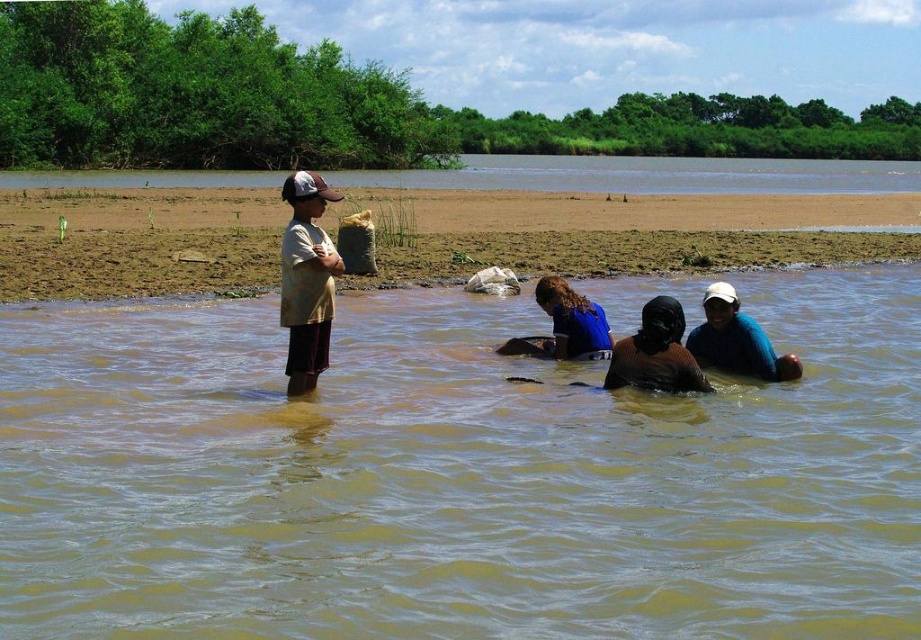
Between brown muddy water at center and brown matte headscarf at center, which one is positioned higher?

brown matte headscarf at center is above.

What are the coordinates of `brown muddy water at center` in the screenshot? It's located at 455,477.

Who is positioned more to the right, brown sandy riverbank at upper center or brown matte headscarf at center?

From the viewer's perspective, brown sandy riverbank at upper center appears more on the right side.

Who is more forward, (165, 172) or (659, 307)?

Point (659, 307)

Image resolution: width=921 pixels, height=640 pixels. Find the location of `brown sandy riverbank at upper center`. brown sandy riverbank at upper center is located at coordinates (648, 176).

Is brown muddy ground at center below blue fabric headscarf at lower center?

No, brown muddy ground at center is not below blue fabric headscarf at lower center.

Can you confirm if brown muddy ground at center is positioned to the left of blue fabric headscarf at lower center?

Indeed, brown muddy ground at center is positioned on the left side of blue fabric headscarf at lower center.

Is point (78, 257) in front of point (752, 332)?

No, (78, 257) is behind (752, 332).

Where is `brown muddy ground at center`? brown muddy ground at center is located at coordinates (628, 252).